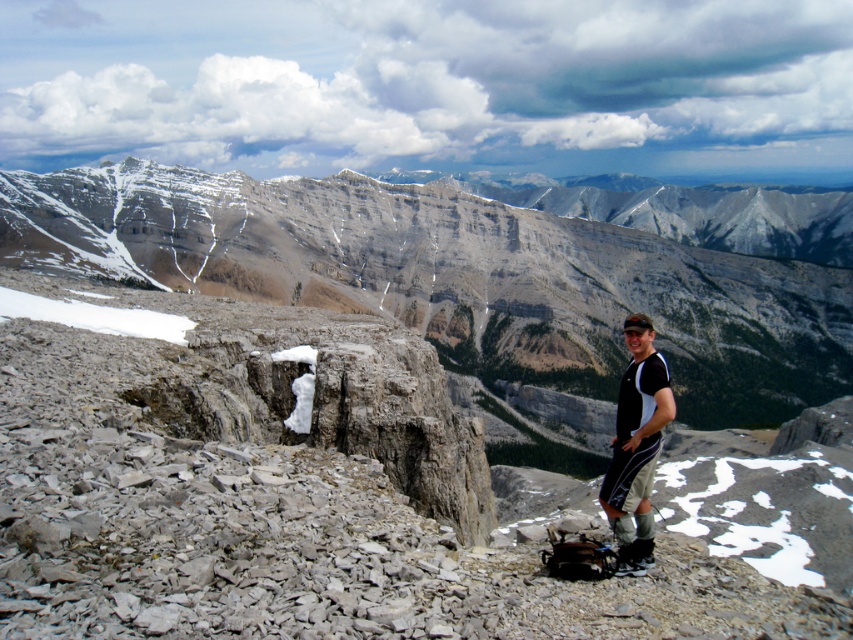
Question: Which of the following is the farthest from the observer?

Choices:
 (A) gray rocky cliff at center
 (B) black fabric shirt at right

Answer: (A)

Question: Which object appears closest to the camera in this image?

Choices:
 (A) gray rocky cliff at center
 (B) black fabric shirt at right

Answer: (B)

Question: Can you confirm if gray rocky cliff at center is thinner than black fabric shirt at right?

Choices:
 (A) yes
 (B) no

Answer: (B)

Question: Can you confirm if gray rocky cliff at center is thinner than black fabric shirt at right?

Choices:
 (A) no
 (B) yes

Answer: (A)

Question: Is gray rocky cliff at center to the right of black fabric shirt at right from the viewer's perspective?

Choices:
 (A) no
 (B) yes

Answer: (B)